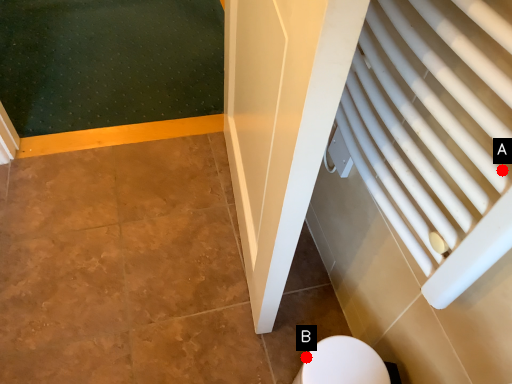
Question: Two points are circled on the image, labeled by A and B beside each circle. Which point is farther to the camera?

Choices:
 (A) A is further
 (B) B is further

Answer: (B)